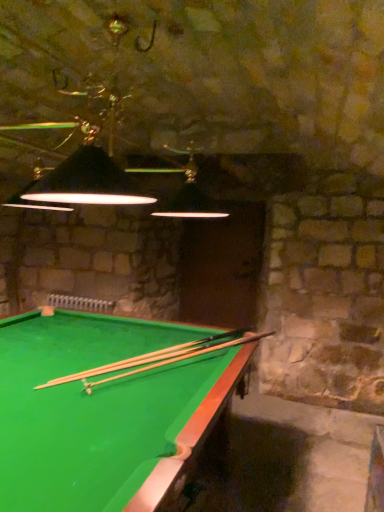
You are a GUI agent. You are given a task and a screenshot of the screen. Output one action in this format:
    pyautogui.click(x=<x>, y=<y>)
    Task: Click on the empty space that is ontop of wooden cue at bottom (from a real-world perspective)
    This screenshot has width=384, height=512.
    Given the screenshot: What is the action you would take?
    pyautogui.click(x=162, y=353)